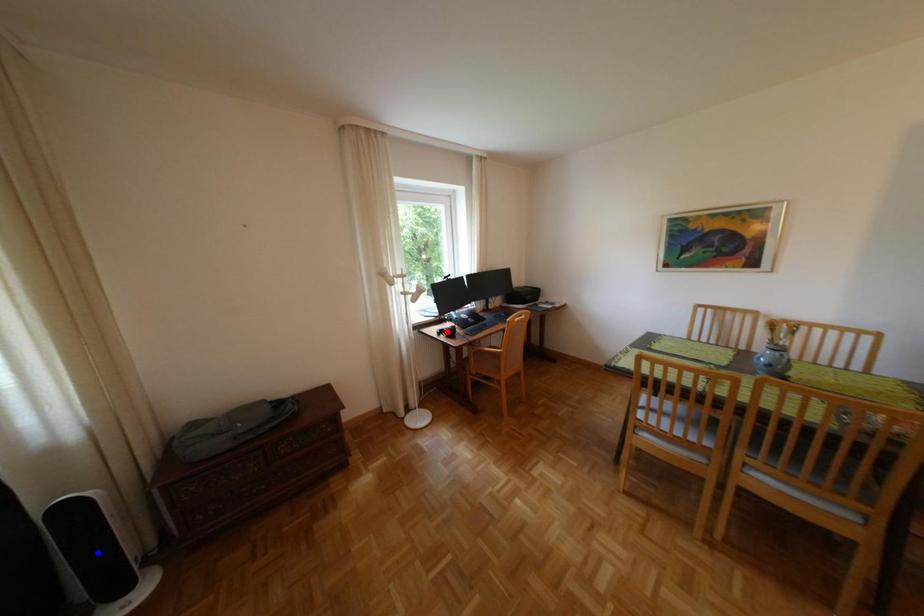
Question: Two points are marked on the image. Which point is closer to the camera?

Choices:
 (A) Blue point is closer.
 (B) Red point is closer.

Answer: (A)